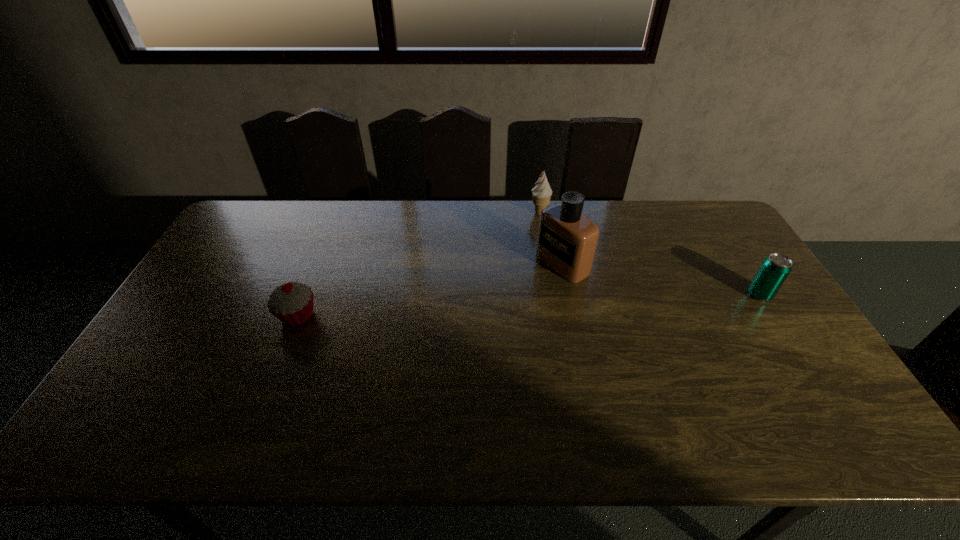
This screenshot has height=540, width=960. What are the coordinates of `vacant space on the desktop that is between the cupcake and the beer can and is positioned on the front label of the third nearest object` in the screenshot? It's located at (489, 307).

In order to click on free space on the desktop that is between the cupcake and the rightmost object and is positioned on the front-facing side of the icecream in this screenshot , I will do `click(579, 303)`.